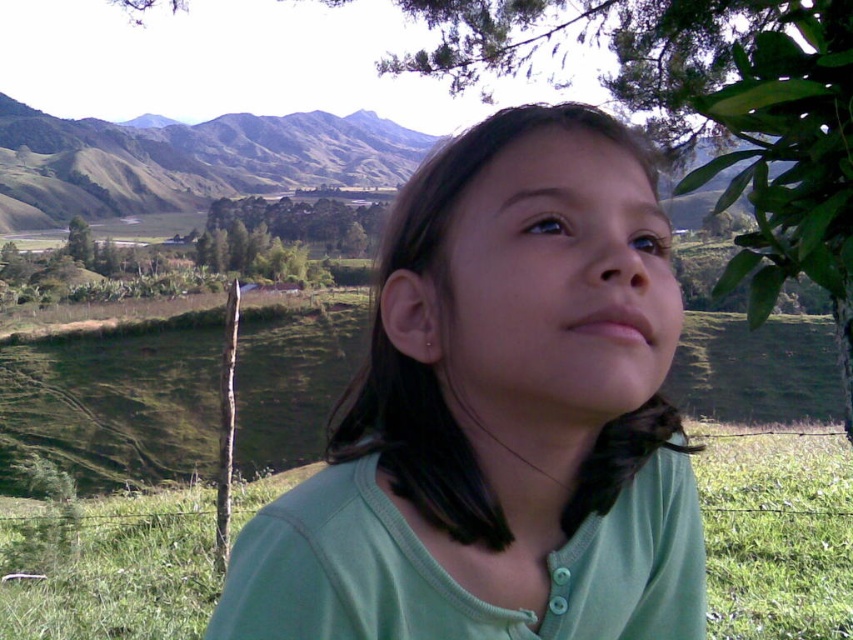
The young girl in the scene is wearing a green matte shirt at center and standing near a green leafy tree at center. Which object takes up more space in the image?

The green leafy tree at center takes up more space in the image than the green matte shirt at center because the green matte shirt at center occupies less space than green leafy tree at center.

Looking at this image, you are a photographer trying to capture the young girl in the image. You want to ensure both the green matte shirt at center and the green leafy tree at center are clearly visible in your shot. Considering their sizes, which object should you focus on to ensure both are in frame?

The green matte shirt at center is not as tall as the green leafy tree at center, so you should focus on the green leafy tree at center to ensure both are in frame since it is taller and will help frame the shot appropriately.